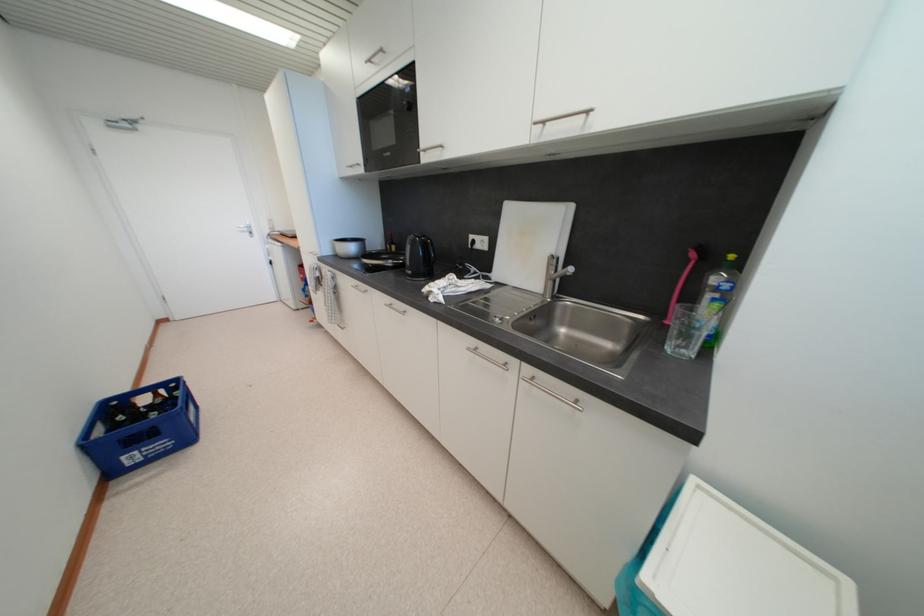
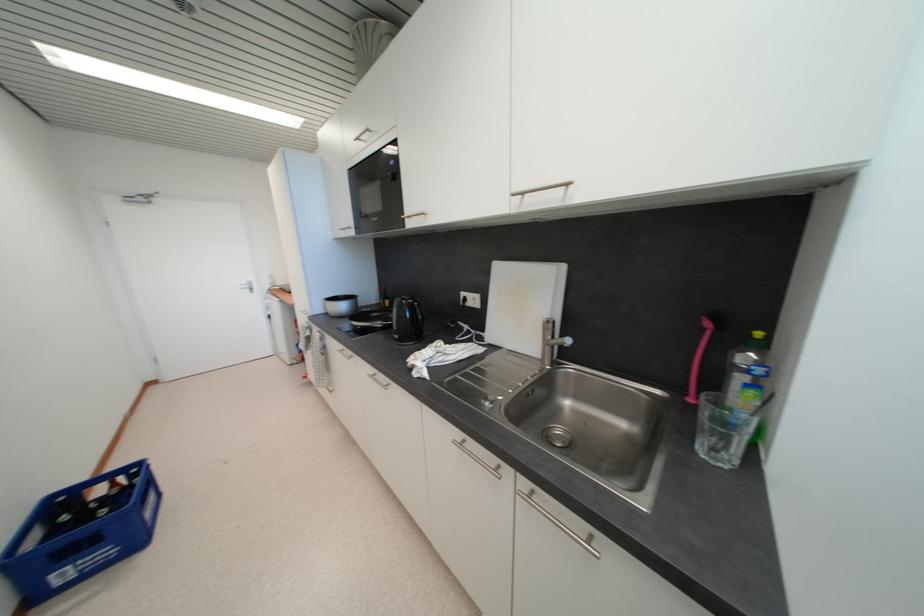
Locate, in the second image, the point that corresponds to point 398,246 in the first image.

(392, 301)